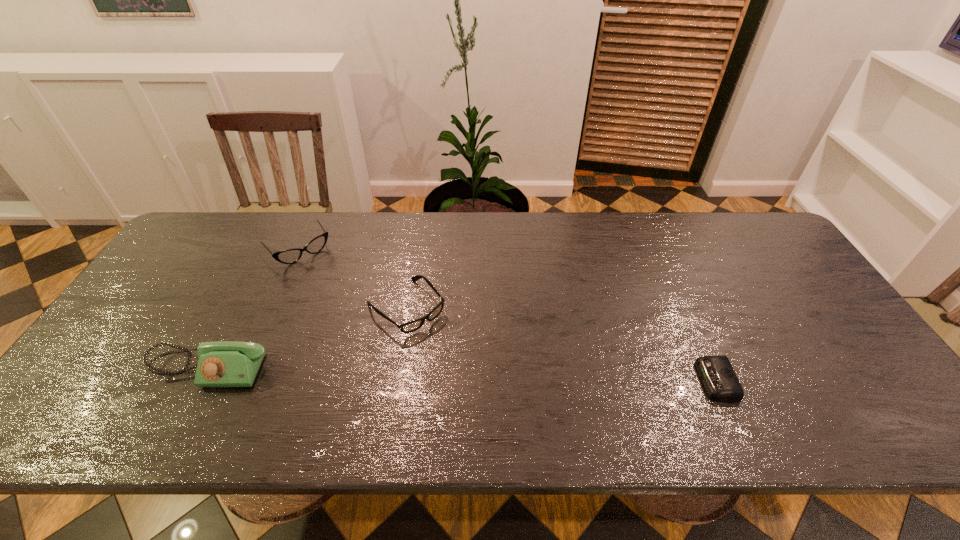
What are the coordinates of `blank space that satisfies the following two spatial constraints: 1. on the front side of the third nearest object; 2. on the display of the rightmost object` in the screenshot? It's located at (395, 381).

Locate an element on the screen. vacant space that satisfies the following two spatial constraints: 1. on the dial of the tallest object; 2. on the display of the rightmost object is located at coordinates (201, 381).

Find the location of `free location that satisfies the following two spatial constraints: 1. on the dial of the rightmost object; 2. on the display of the telephone`. free location that satisfies the following two spatial constraints: 1. on the dial of the rightmost object; 2. on the display of the telephone is located at coordinates pos(201,381).